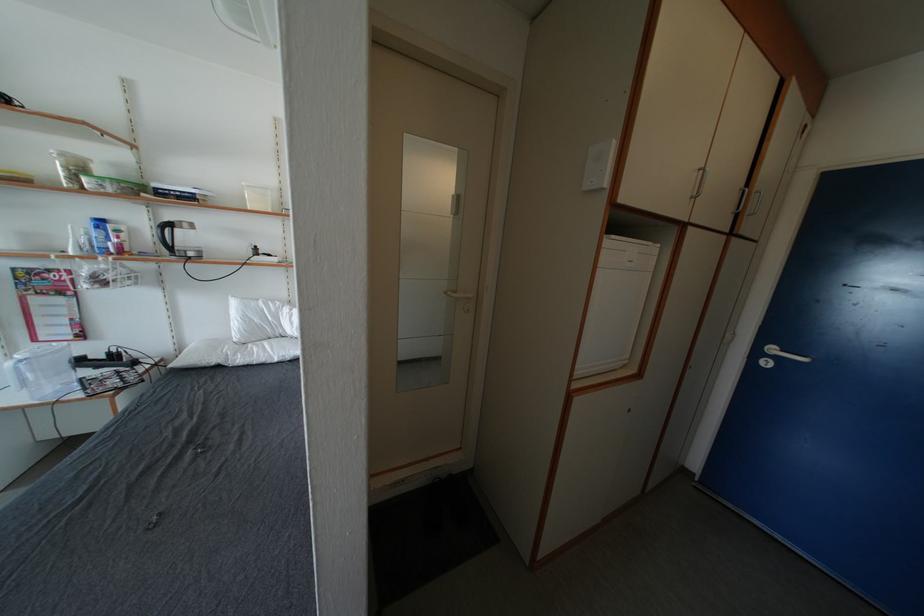
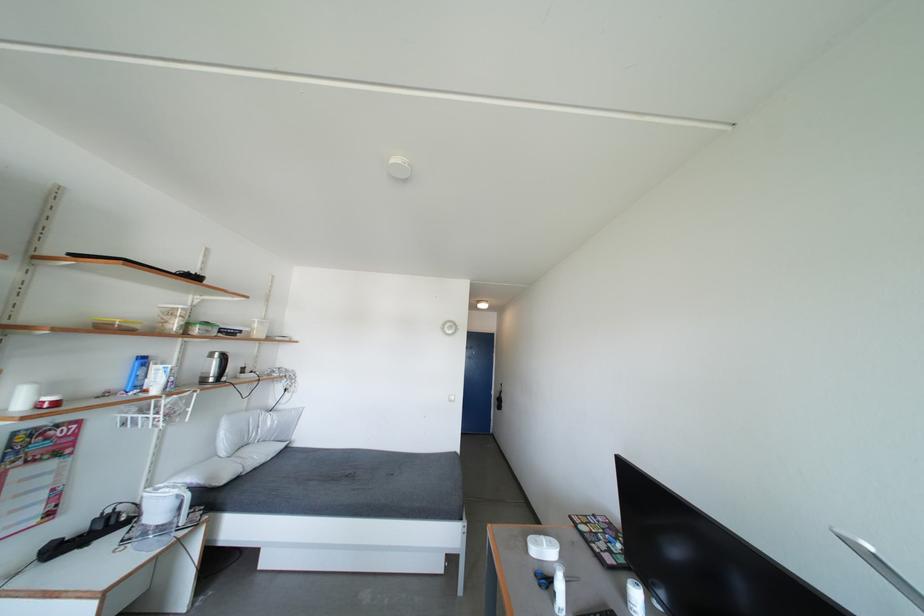
The point at (x=238, y=322) is marked in the first image. Where is the corresponding point in the second image?

(228, 439)